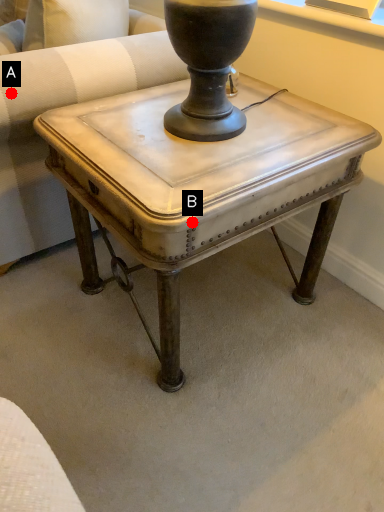
Question: Two points are circled on the image, labeled by A and B beside each circle. Which point is farther from the camera taking this photo?

Choices:
 (A) A is further
 (B) B is further

Answer: (A)